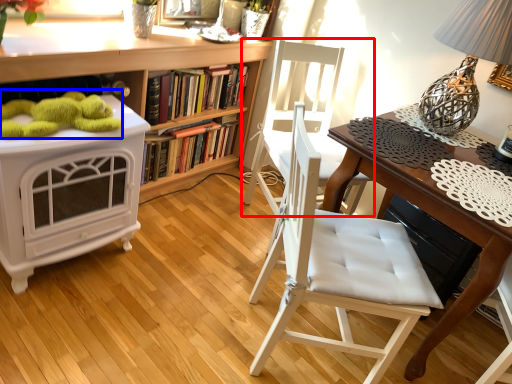
Question: Which object is further to the camera taking this photo, chair (highlighted by a red box) or toy (highlighted by a blue box)?

Choices:
 (A) chair
 (B) toy

Answer: (A)